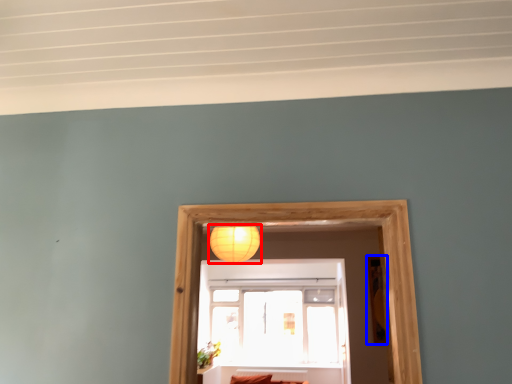
Question: Which point is closer to the camera, lamp (highlighted by a red box) or picture frame (highlighted by a blue box)?

Choices:
 (A) lamp
 (B) picture frame

Answer: (A)